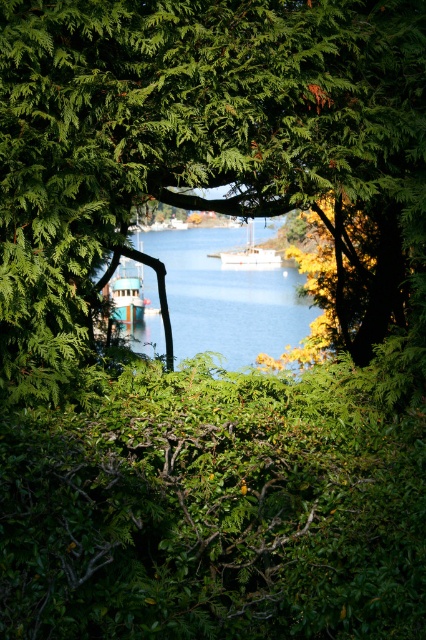
You are a photographer standing at the edge of the water. You want to take a photo of the teal glossy boat at center and the blue water at center such that both are clearly visible. Given that your camera has a minimum focus distance of 36 inches, will you be able to capture both objects in focus without moving closer?

The blue water at center and teal glossy boat at center are 36.84 inches apart from each other. Since the distance between them is greater than the camera minimum focus distance of 36 inches, the photographer can capture both objects in focus without moving closer.

You are an observer looking at the scene through the canopy. Which boat, the teal glossy boat at center or the white matte sailboat at center, is closer to you?

The teal glossy boat at center is closer to you because it is in front of the white matte sailboat at center.